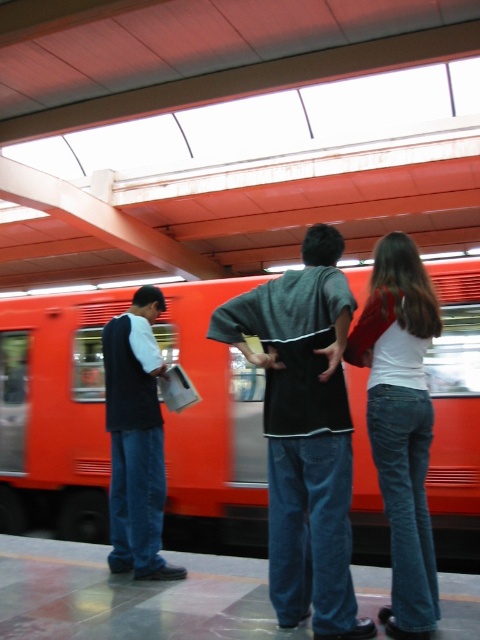
You are standing on a subway platform and see an orange metallic train at center and a dark gray cotton shirt at center. Which object is positioned to the right side?

The orange metallic train at center is positioned to the right of the dark gray cotton shirt at center.

You are a photographer trying to capture a candid shot of the two people on the subway platform. You notice the dark gray cotton shirt at center and the white matte shirt at center. Which one do you think will take up more space in your photo?

The dark gray cotton shirt at center has a larger width than the white matte shirt at center, so it will take up more space in the photo.

You are standing on the subway platform and want to board the orange metallic train at center. The platform has a boarding area marked at coordinates 0.6, 0.1. Are you currently positioned close enough to the boarding area to board the train?

The orange metallic train at center is located at coordinates (55, 412), which is very close to the boarding area at (48, 384). You are positioned close enough to board the train.